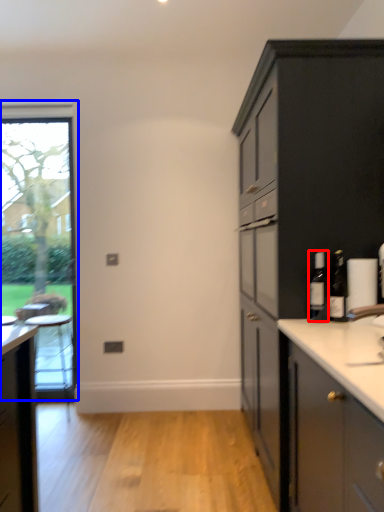
Question: Which of the following is the farthest to the observer, bottle (highlighted by a red box) or window (highlighted by a blue box)?

Choices:
 (A) bottle
 (B) window

Answer: (B)